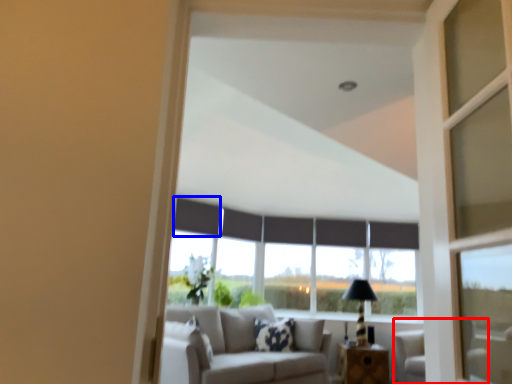
Question: Which point is further to the camera, armchair (highlighted by a red box) or curtain (highlighted by a blue box)?

Choices:
 (A) armchair
 (B) curtain

Answer: (B)